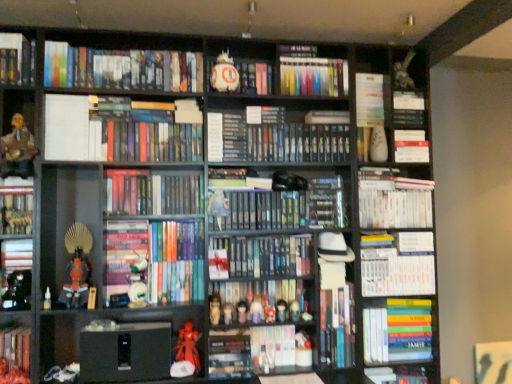
Question: From the image's perspective, relative to matte plastic figurine at center, the sixth toy positioned from the right, is matte brown leather jacket at left above or below?

Choices:
 (A) below
 (B) above

Answer: (B)

Question: Based on their sizes in the image, would you say matte brown leather jacket at left is bigger or smaller than matte plastic figurine at center, which is counted as the 7th toy, starting from the left?

Choices:
 (A) big
 (B) small

Answer: (A)

Question: Considering the real-world distances, which object is farthest from the hardcover books at center, which is counted as the second book, starting from the top?

Choices:
 (A) matte red figurine at lower center, the 5th toy from the left
 (B) matte plastic figurine at center, positioned as the fourth toy in right-to-left order
 (C) hardcover book at center, the 21th book positioned from the top
 (D) orange fabric figurine at lower left, acting as the tenth toy starting from the right
 (E) hardcover books at right, the 6th book ordered from the bottom

Answer: (A)

Question: Estimate the real-world distances between objects in this image. Which object is closer to the hardcover books at center, which is the 17th book in bottom-to-top order?

Choices:
 (A) matte red figurine at center, which appears as the 8th toy when viewed from the left
 (B) hardcover book at center, the 21th book positioned from the top
 (C) hardcover book at center, arranged as the eighth book when ordered from the bottom
 (D) hardcover book at center, the 8th book when ordered from top to bottom
 (E) black hardcover books at center, the 5th book when ordered from top to bottom

Answer: (C)